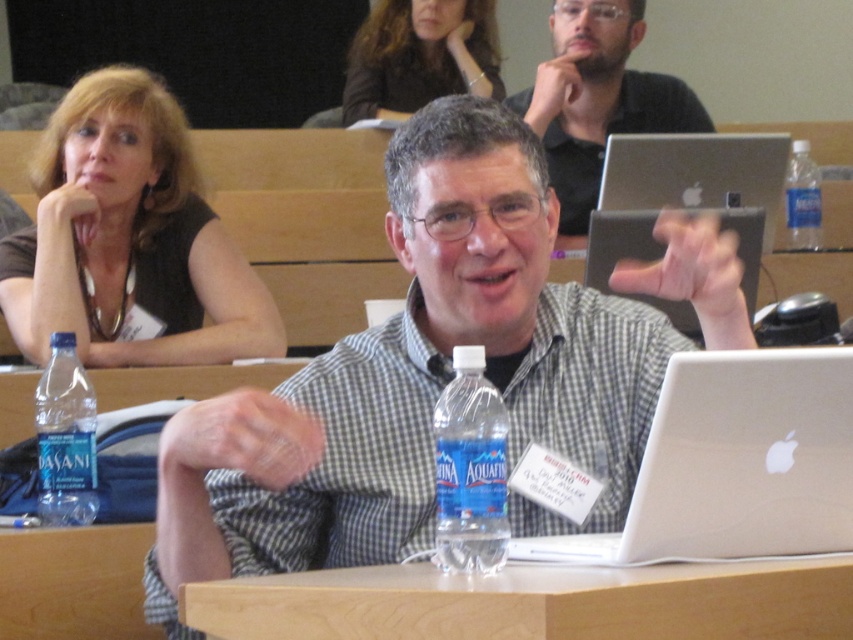
Is matte black shirt at upper left in front of dark brown hair at upper center?

Yes, matte black shirt at upper left is in front of dark brown hair at upper center.

Can you confirm if matte black shirt at upper left is positioned to the left of dark brown hair at upper center?

Correct, you'll find matte black shirt at upper left to the left of dark brown hair at upper center.

Find the location of `matte black shirt at upper left`. matte black shirt at upper left is located at coordinates (128, 240).

Can you confirm if matte black laptop at upper center is positioned below blue translucent water bottle at center?

No.

You are a GUI agent. You are given a task and a screenshot of the screen. Output one action in this format:
    pyautogui.click(x=<x>, y=<y>)
    Task: Click on the matte black laptop at upper center
    The height and width of the screenshot is (640, 853).
    Given the screenshot: What is the action you would take?
    pyautogui.click(x=596, y=99)

Is point (692, 273) less distant than point (820, 209)?

Yes, it is.

Which is behind, point (352, 524) or point (809, 168)?

The point (809, 168) is behind.

The height and width of the screenshot is (640, 853). I want to click on checkered fabric shirt at center, so click(x=416, y=381).